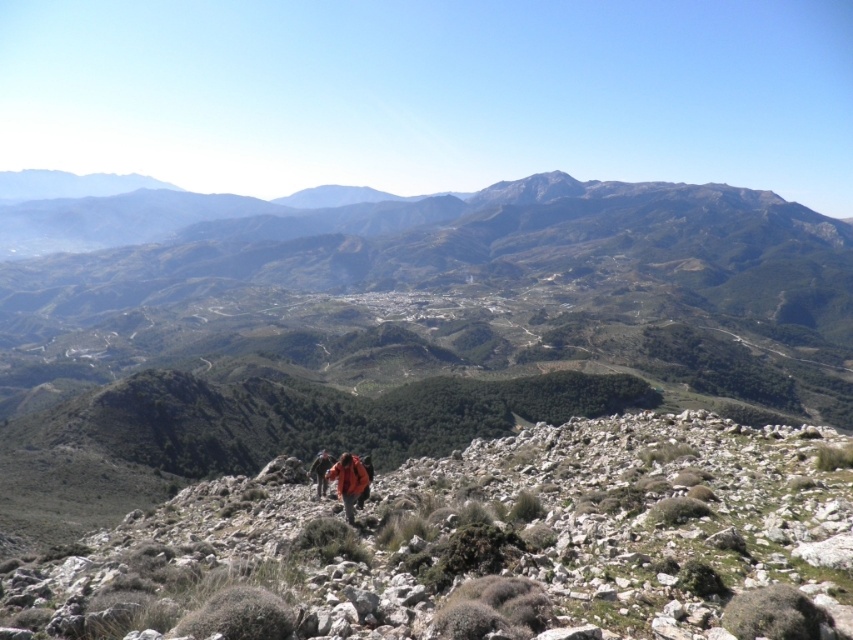
Question: Which point appears closest to the camera in this image?

Choices:
 (A) (338, 464)
 (B) (318, 476)

Answer: (A)

Question: Can you confirm if orange fabric jacket at center is smaller than orange fabric backpack at center?

Choices:
 (A) no
 (B) yes

Answer: (B)

Question: Does orange fabric jacket at center appear on the left side of orange fabric backpack at center?

Choices:
 (A) no
 (B) yes

Answer: (A)

Question: Which point is farther to the camera?

Choices:
 (A) (311, 472)
 (B) (363, 484)

Answer: (A)

Question: Is the position of orange fabric jacket at center less distant than that of orange fabric backpack at center?

Choices:
 (A) no
 (B) yes

Answer: (B)